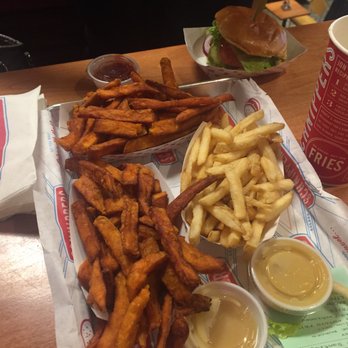
What are the coordinates of `paper cup` in the screenshot? It's located at (334, 44).